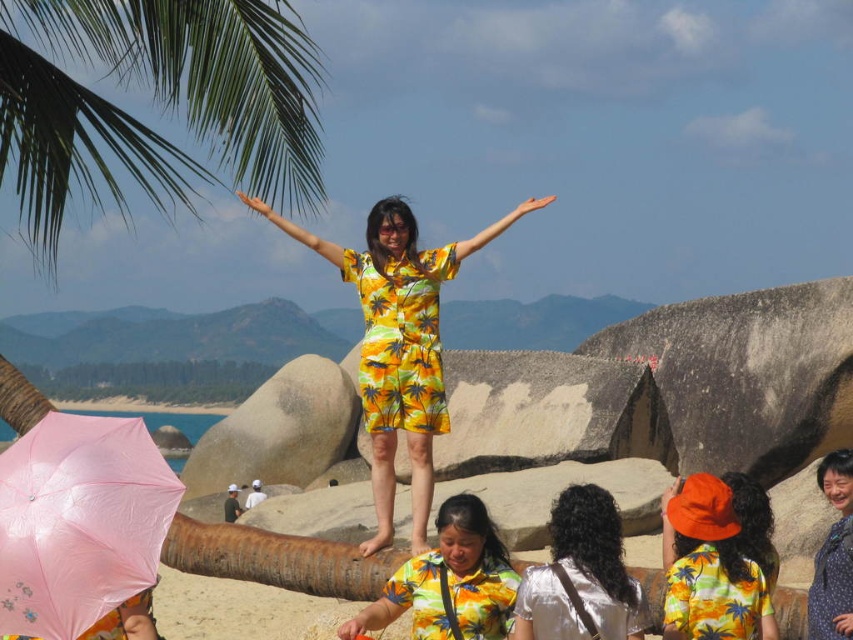
Question: Can you confirm if pink matte umbrella at lower left is bigger than yellow printed shirt at center?

Choices:
 (A) yes
 (B) no

Answer: (A)

Question: Which object is the farthest from the pink matte umbrella at lower left?

Choices:
 (A) yellow printed dress at center
 (B) yellow printed shirt at center

Answer: (A)

Question: Does yellow printed dress at center have a lesser width compared to orange cotton hat at center?

Choices:
 (A) no
 (B) yes

Answer: (A)

Question: Can you confirm if pink matte umbrella at lower left is positioned below yellow printed shirt at center?

Choices:
 (A) no
 (B) yes

Answer: (A)

Question: Estimate the real-world distances between objects in this image. Which object is farther from the orange cotton hat at center?

Choices:
 (A) green leafy palm tree at upper left
 (B) yellow palm print fabric dress at center

Answer: (A)

Question: Among these objects, which one is nearest to the camera?

Choices:
 (A) orange cotton hat at center
 (B) green leafy palm tree at upper left
 (C) yellow printed dress at center
 (D) yellow palm print fabric dress at center

Answer: (A)